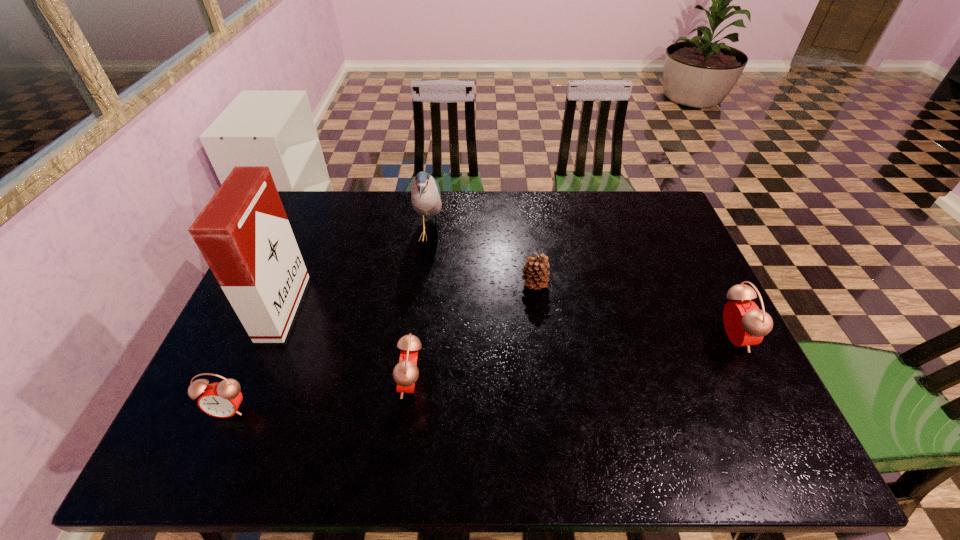
If the aim is uniform spacing by inserting an additional alarm_clock among them, please point to a vacant space for this new alarm_clock. Please provide its 2D coordinates. Your answer should be formatted as a tuple, i.e. [(x, y)], where the tuple contains the x and y coordinates of a point satisfying the conditions above.

[(579, 359)]